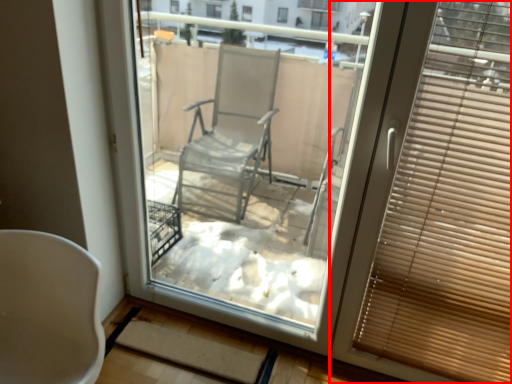
Question: Where is window blind (annotated by the red box) located in relation to chair in the image?

Choices:
 (A) left
 (B) right

Answer: (B)